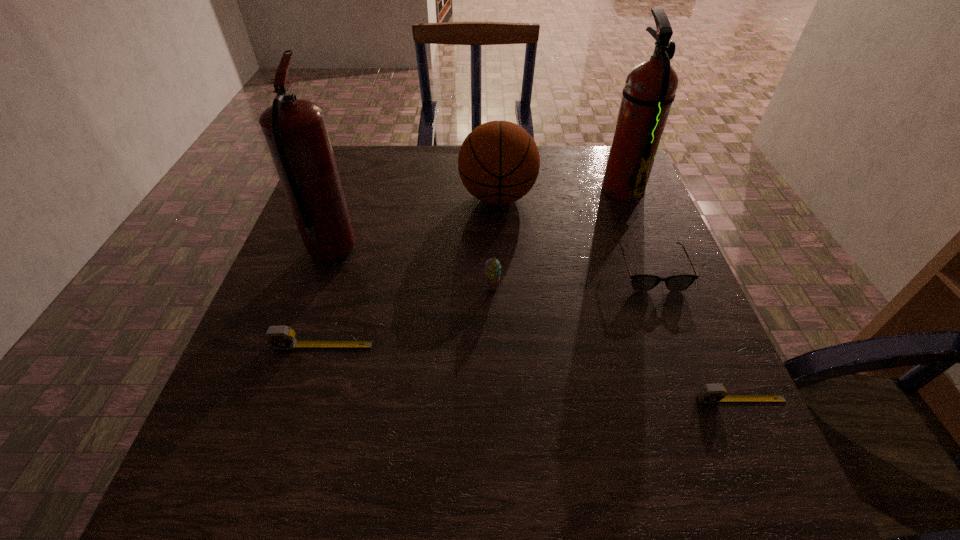
What are the coordinates of `fire extinguisher at the far edge` in the screenshot? It's located at (650, 87).

The height and width of the screenshot is (540, 960). I want to click on object present at the near edge, so click(710, 393).

What are the coordinates of `tape measure located at the left edge` in the screenshot? It's located at (279, 337).

I want to click on fire extinguisher that is at the left edge, so click(295, 131).

Locate an element on the screen. This screenshot has width=960, height=540. tape measure present at the right edge is located at coordinates (710, 393).

The width and height of the screenshot is (960, 540). I want to click on fire extinguisher that is at the right edge, so click(x=650, y=87).

Locate an element on the screen. The width and height of the screenshot is (960, 540). spectacles that is positioned at the right edge is located at coordinates (642, 282).

This screenshot has width=960, height=540. I want to click on object that is at the far right corner, so pos(650,87).

Find the location of a particular element. The height and width of the screenshot is (540, 960). object that is positioned at the near right corner is located at coordinates (710, 393).

This screenshot has height=540, width=960. Identify the location of blank space at the far edge of the desktop. (381, 184).